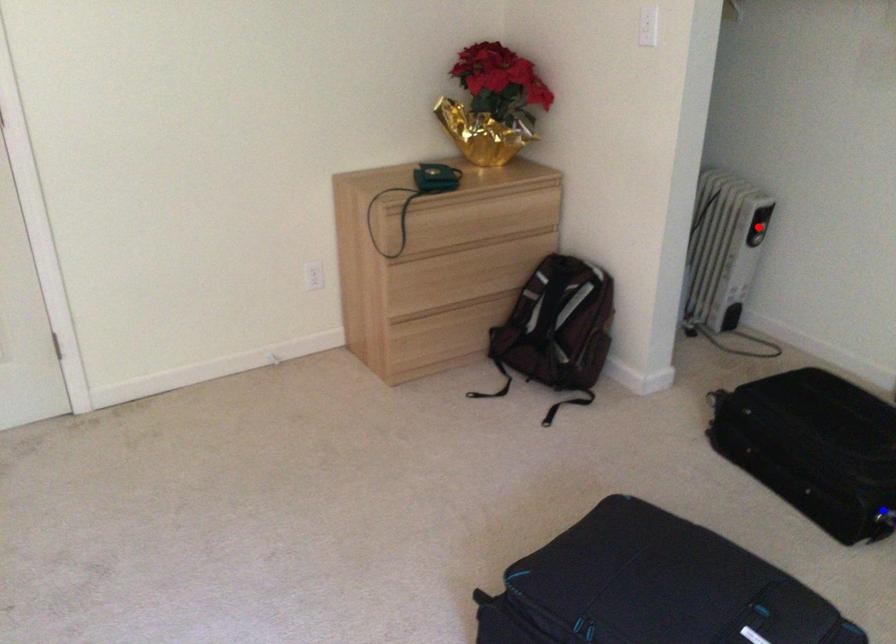
Question: Two points are marked on the image. Which point is closer to the camera?

Choices:
 (A) Blue point is closer.
 (B) Red point is closer.

Answer: (A)